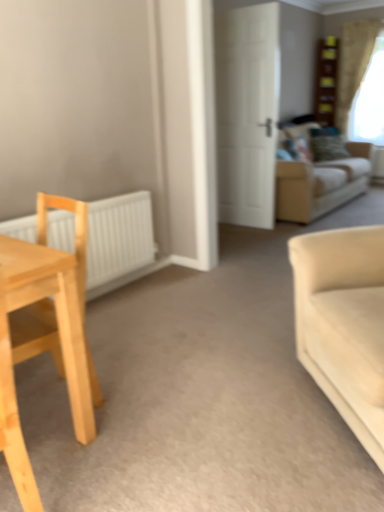
Question: Considering the positions of white matte door at center and beige fabric couch at upper right, the first studio couch from the top, in the image, is white matte door at center taller or shorter than beige fabric couch at upper right, the first studio couch from the top,?

Choices:
 (A) tall
 (B) short

Answer: (A)

Question: Is point (226, 104) closer or farther from the camera than point (276, 178)?

Choices:
 (A) closer
 (B) farther

Answer: (B)

Question: Estimate the real-world distances between objects in this image. Which object is farther from the green textured pillow at upper right?

Choices:
 (A) beige fabric couch at right, the 1th studio couch positioned from the front
 (B) white sheer curtain at upper right
 (C) white matte door at center
 (D) white matte radiator at left
 (E) beige fabric couch at upper right, arranged as the second studio couch when ordered from the bottom

Answer: (A)

Question: Which is farther from the beige fabric couch at right, which is the first studio couch from bottom to top?

Choices:
 (A) white matte radiator at left
 (B) light wood chair at left
 (C) white matte door at center
 (D) white sheer curtain at upper right
 (E) green textured pillow at upper right

Answer: (D)